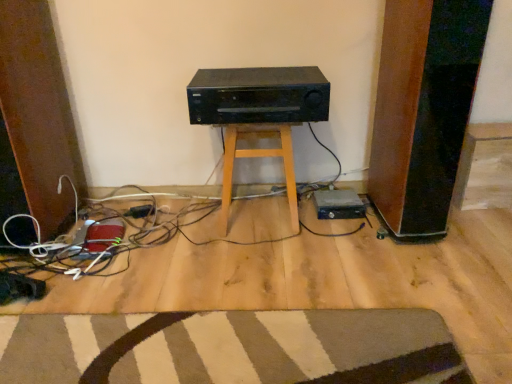
Where is `free spot to the right of black plastic plug at lower center`? The image size is (512, 384). free spot to the right of black plastic plug at lower center is located at coordinates pos(173,211).